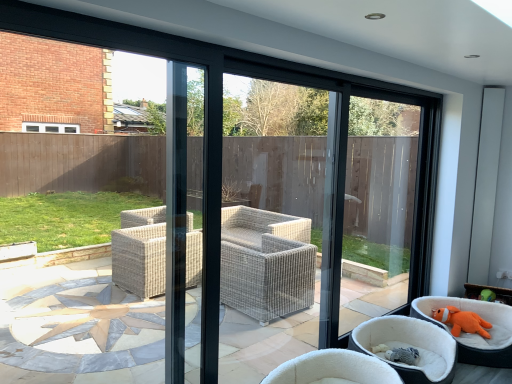
Question: Is point (456, 319) positioned closer to the camera than point (389, 345)?

Choices:
 (A) farther
 (B) closer

Answer: (A)

Question: From the image's perspective, relative to orange plush toy at lower right, which is the 2th chair in right-to-left order, is orange plush toy at lower right above or below?

Choices:
 (A) above
 (B) below

Answer: (A)

Question: Estimate the real-world distances between objects in this image. Which object is closer to the orange plush toy at lower right, the third chair positioned from the left?

Choices:
 (A) orange plush toy at lower right
 (B) white wicker chair at center, the first chair from the left
 (C) orange plush toy at lower right, which is the 2th chair in right-to-left order

Answer: (A)

Question: Based on their relative distances, which object is nearer to the orange plush toy at lower right, which is the 2th chair in right-to-left order?

Choices:
 (A) orange plush toy at lower right
 (B) white wicker chair at center, the first chair from the left
 (C) orange plush toy at lower right, the third chair positioned from the left

Answer: (C)